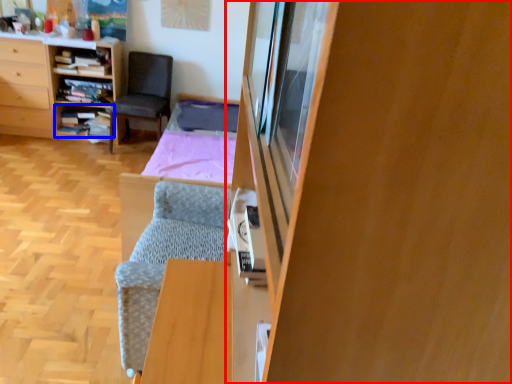
Question: Among these objects, which one is nearest to the camera, cabinetry (highlighted by a red box) or shelf (highlighted by a blue box)?

Choices:
 (A) cabinetry
 (B) shelf

Answer: (A)